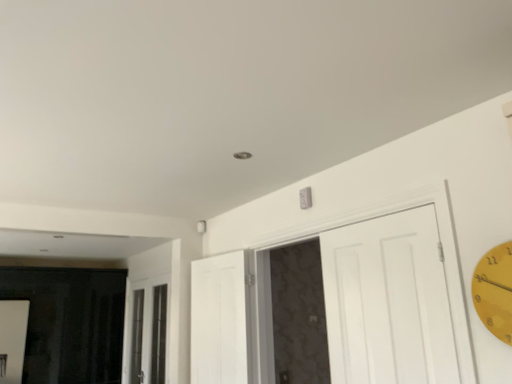
Find the location of a particular element. yellow matte clock at right is located at coordinates (495, 291).

At what (x,y) coordinates should I click in order to perform the action: click on white matte door at upper center, the 2th door from the left. Please return your answer as a coordinate pair (x, y). The width and height of the screenshot is (512, 384). Looking at the image, I should click on (393, 300).

In order to face white matte door at upper center, the 1th door viewed from the right, should I rotate leftwards or rightwards?

To align with it, rotate right about 9.688°.

Measure the distance between clear glass window at center and camera.

clear glass window at center and camera are 4.07 meters apart.

Where is `yellow matte clock at right`? The height and width of the screenshot is (384, 512). yellow matte clock at right is located at coordinates (495, 291).

Which is in front, point (498, 257) or point (239, 252)?

Positioned in front is point (498, 257).

From their relative heights in the image, would you say yellow matte clock at right is taller or shorter than white wood door at center, the 2th door positioned from the right?

In the image, yellow matte clock at right appears to be shorter than white wood door at center, the 2th door positioned from the right.

Could you tell me if yellow matte clock at right is turned towards white wood door at center, which ranks as the 1th door in left-to-right order?

No, yellow matte clock at right does not turn towards white wood door at center, which ranks as the 1th door in left-to-right order.

From a real-world perspective, is yellow matte clock at right located higher than white wood door at center, which ranks as the 1th door in left-to-right order?

Correct, in the physical world, yellow matte clock at right is higher than white wood door at center, which ranks as the 1th door in left-to-right order.

In the image, is clear glass window at center on the left side or the right side of white wood door at center, the 2th door positioned from the right?

Clearly, clear glass window at center is on the left of white wood door at center, the 2th door positioned from the right, in the image.

Does clear glass window at center have a greater height compared to white wood door at center, the 2th door positioned from the right?

Yes, clear glass window at center is taller than white wood door at center, the 2th door positioned from the right.

Can you see clear glass window at center touching white wood door at center, which ranks as the 1th door in left-to-right order?

clear glass window at center and white wood door at center, which ranks as the 1th door in left-to-right order, are not in contact.

In terms of width, does clear glass window at center look wider or thinner when compared to white wood door at center, which ranks as the 1th door in left-to-right order?

clear glass window at center is thinner than white wood door at center, which ranks as the 1th door in left-to-right order.

This screenshot has width=512, height=384. I want to click on window that appears on the left of white matte door at upper center, the 2th door from the left, so click(148, 330).

From a real-world perspective, is clear glass window at center above or below white matte door at upper center, the 2th door from the left?

From a real-world perspective, clear glass window at center is physically below white matte door at upper center, the 2th door from the left.

Relative to white matte door at upper center, the 2th door from the left, is clear glass window at center in front or behind?

clear glass window at center is positioned farther from the viewer than white matte door at upper center, the 2th door from the left.

How many degrees apart are the facing directions of clear glass window at center and white matte door at upper center, the 2th door from the left?

They differ by 0.362 degrees in their facing directions.

Based on their positions, is yellow matte clock at right located to the left or right of white matte door at upper center, the 1th door viewed from the right?

yellow matte clock at right is positioned on white matte door at upper center, the 1th door viewed from the right,'s right side.

From the image's perspective, between yellow matte clock at right and white matte door at upper center, the 2th door from the left, which one is located above?

yellow matte clock at right is shown above in the image.

Is yellow matte clock at right surrounding white matte door at upper center, the 1th door viewed from the right?

That's incorrect, white matte door at upper center, the 1th door viewed from the right, is not inside yellow matte clock at right.

Relative to white matte door at upper center, the 2th door from the left, is yellow matte clock at right in front or behind?

yellow matte clock at right is in front of white matte door at upper center, the 2th door from the left.

In terms of width, does white matte door at upper center, the 1th door viewed from the right, look wider or thinner when compared to white wood door at center, the 2th door positioned from the right?

In the image, white matte door at upper center, the 1th door viewed from the right, appears to be wider than white wood door at center, the 2th door positioned from the right.

Considering the relative sizes of white matte door at upper center, the 2th door from the left, and white wood door at center, which ranks as the 1th door in left-to-right order, in the image provided, is white matte door at upper center, the 2th door from the left, shorter than white wood door at center, which ranks as the 1th door in left-to-right order,?

No, white matte door at upper center, the 2th door from the left, is not shorter than white wood door at center, which ranks as the 1th door in left-to-right order.

Which object is positioned more to the left, white matte door at upper center, the 1th door viewed from the right, or white wood door at center, the 2th door positioned from the right?

white wood door at center, the 2th door positioned from the right, is more to the left.

Is point (377, 282) positioned before point (211, 318)?

Yes, point (377, 282) is closer to viewer.

From the image's perspective, which one is positioned higher, white wood door at center, which ranks as the 1th door in left-to-right order, or yellow matte clock at right?

yellow matte clock at right is shown above in the image.

Does white wood door at center, the 2th door positioned from the right, lie behind yellow matte clock at right?

That is True.

Can we say white wood door at center, the 2th door positioned from the right, lies outside yellow matte clock at right?

white wood door at center, the 2th door positioned from the right, is positioned outside yellow matte clock at right.

Is white wood door at center, which ranks as the 1th door in left-to-right order, placed right next to yellow matte clock at right?

white wood door at center, which ranks as the 1th door in left-to-right order, and yellow matte clock at right are clearly separated.

Would you say white matte door at upper center, the 1th door viewed from the right, is part of white wood door at center, which ranks as the 1th door in left-to-right order,'s contents?

Actually, white matte door at upper center, the 1th door viewed from the right, is outside white wood door at center, which ranks as the 1th door in left-to-right order.

Is white wood door at center, which ranks as the 1th door in left-to-right order, positioned with its back to white matte door at upper center, the 2th door from the left?

No, white matte door at upper center, the 2th door from the left, is not at the back of white wood door at center, which ranks as the 1th door in left-to-right order.

Is white wood door at center, which ranks as the 1th door in left-to-right order, next to white matte door at upper center, the 2th door from the left, and touching it?

Yes, white wood door at center, which ranks as the 1th door in left-to-right order, and white matte door at upper center, the 2th door from the left, clearly make contact.

From the image's perspective, is white wood door at center, which ranks as the 1th door in left-to-right order, over white matte door at upper center, the 2th door from the left?

Actually, white wood door at center, which ranks as the 1th door in left-to-right order, appears below white matte door at upper center, the 2th door from the left, in the image.

Locate an element on the screen. Image resolution: width=512 pixels, height=384 pixels. the 2nd door behind the yellow matte clock at right is located at coordinates (221, 319).

The height and width of the screenshot is (384, 512). In the image, there is a white wood door at center, which ranks as the 1th door in left-to-right order. In order to click on window below it (from a real-world perspective) in this screenshot , I will do `click(148, 330)`.

From the image, which object appears to be farther from white wood door at center, which ranks as the 1th door in left-to-right order, yellow matte clock at right or clear glass window at center?

The object further to white wood door at center, which ranks as the 1th door in left-to-right order, is yellow matte clock at right.

Considering their positions, is white wood door at center, which ranks as the 1th door in left-to-right order, positioned closer to clear glass window at center than white matte door at upper center, the 1th door viewed from the right?

white wood door at center, which ranks as the 1th door in left-to-right order, is positioned closer to the anchor clear glass window at center.

Estimate the real-world distances between objects in this image. Which object is further from clear glass window at center, white wood door at center, the 2th door positioned from the right, or yellow matte clock at right?

Based on the image, yellow matte clock at right appears to be further to clear glass window at center.

From the image, which object appears to be farther from clear glass window at center, white matte door at upper center, the 1th door viewed from the right, or yellow matte clock at right?

Among the two, yellow matte clock at right is located further to clear glass window at center.

Based on their spatial positions, is white matte door at upper center, the 1th door viewed from the right, or white wood door at center, which ranks as the 1th door in left-to-right order, further from yellow matte clock at right?

white wood door at center, which ranks as the 1th door in left-to-right order, is further to yellow matte clock at right.

Which object lies further to the anchor point white matte door at upper center, the 1th door viewed from the right, clear glass window at center or white wood door at center, the 2th door positioned from the right?

Based on the image, clear glass window at center appears to be further to white matte door at upper center, the 1th door viewed from the right.

When comparing their distances from white matte door at upper center, the 1th door viewed from the right, does white wood door at center, the 2th door positioned from the right, or clear glass window at center seem closer?

The object closer to white matte door at upper center, the 1th door viewed from the right, is white wood door at center, the 2th door positioned from the right.

Considering their positions, is white matte door at upper center, the 1th door viewed from the right, positioned closer to white wood door at center, the 2th door positioned from the right, than yellow matte clock at right?

The object closer to white wood door at center, the 2th door positioned from the right, is white matte door at upper center, the 1th door viewed from the right.

At what (x,y) coordinates should I click in order to perform the action: click on door between yellow matte clock at right and white wood door at center, which ranks as the 1th door in left-to-right order, along the z-axis. Please return your answer as a coordinate pair (x, y). This screenshot has width=512, height=384. Looking at the image, I should click on (393, 300).

Locate an element on the screen. Image resolution: width=512 pixels, height=384 pixels. door between white matte door at upper center, the 2th door from the left, and clear glass window at center from front to back is located at coordinates (221, 319).